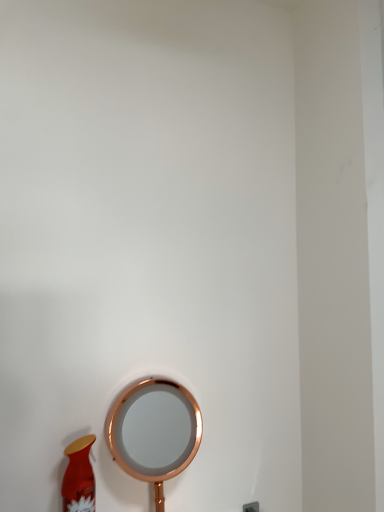
The height and width of the screenshot is (512, 384). What do you see at coordinates (154, 431) in the screenshot?
I see `copper metallic table lamp at lower center` at bounding box center [154, 431].

What is the approximate width of copper metallic table lamp at lower center?

The width of copper metallic table lamp at lower center is 3.51 inches.

Image resolution: width=384 pixels, height=512 pixels. In order to click on copper metallic table lamp at lower center in this screenshot , I will do `click(154, 431)`.

This screenshot has height=512, width=384. Identify the location of copper metallic table lamp at lower center. coord(154,431).